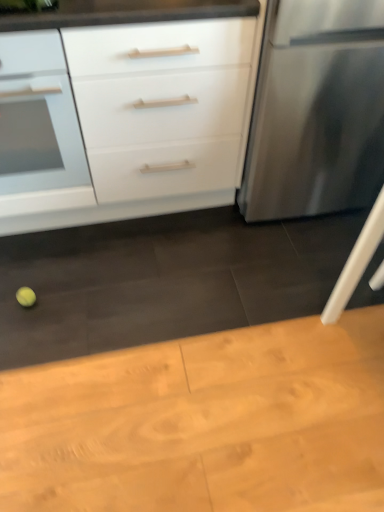
Image resolution: width=384 pixels, height=512 pixels. Identify the location of vacant space that is to the left of yellow matte tennis ball at lower left. click(10, 291).